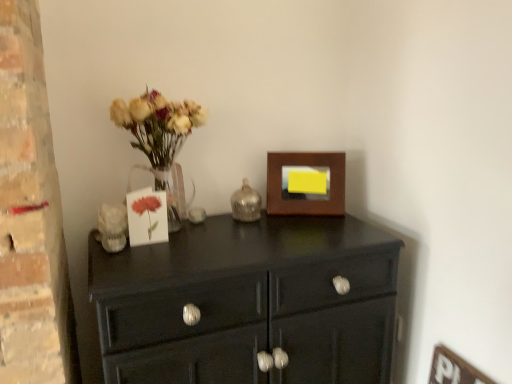
Question: Which is correct: matte glass vase with dried flowers at left is inside glossy black cabinet at center, or outside of it?

Choices:
 (A) outside
 (B) inside

Answer: (A)

Question: From a real-world perspective, is matte glass vase with dried flowers at left above or below glossy black cabinet at center?

Choices:
 (A) below
 (B) above

Answer: (B)

Question: Which object is positioned closest to the matte glass vase with dried flowers at left?

Choices:
 (A) wooden picture frame at upper right
 (B) shiny metallic candle holder at center
 (C) glossy black cabinet at center
 (D) white matte card at center

Answer: (D)

Question: Which object is the farthest from the glossy black cabinet at center?

Choices:
 (A) shiny metallic candle holder at center
 (B) wooden picture frame at upper right
 (C) matte glass vase with dried flowers at left
 (D) white matte card at center

Answer: (D)